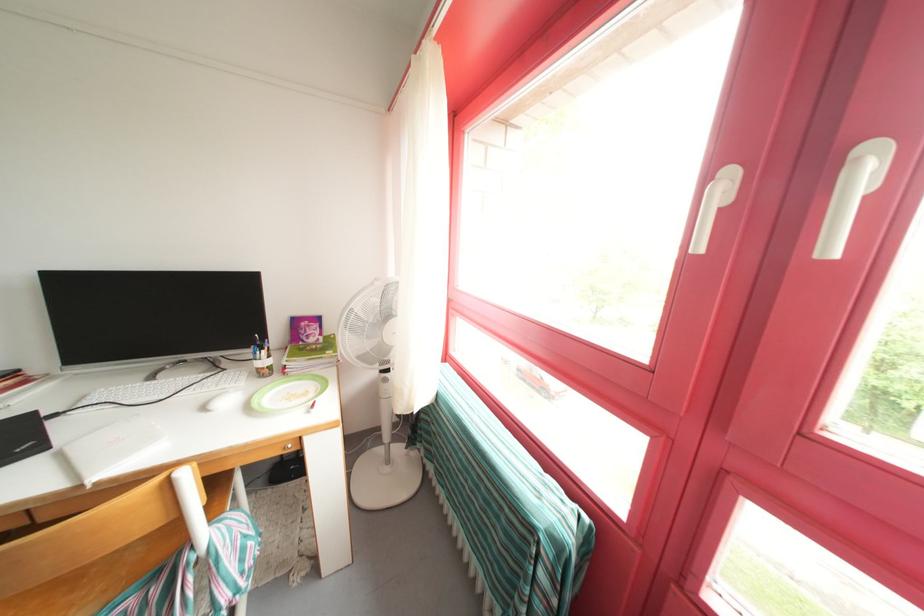
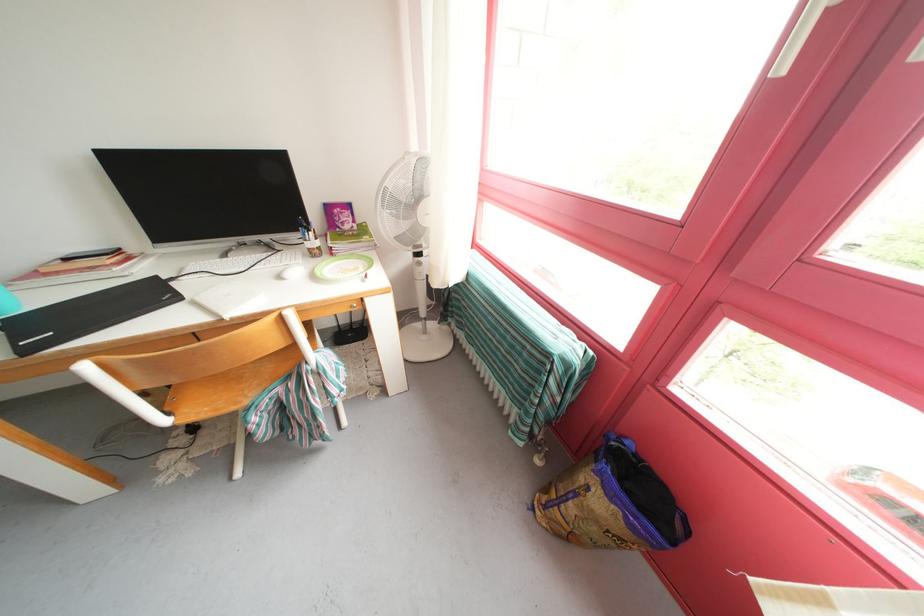
The point at (x=393, y=387) is marked in the first image. Where is the corresponding point in the second image?

(427, 270)